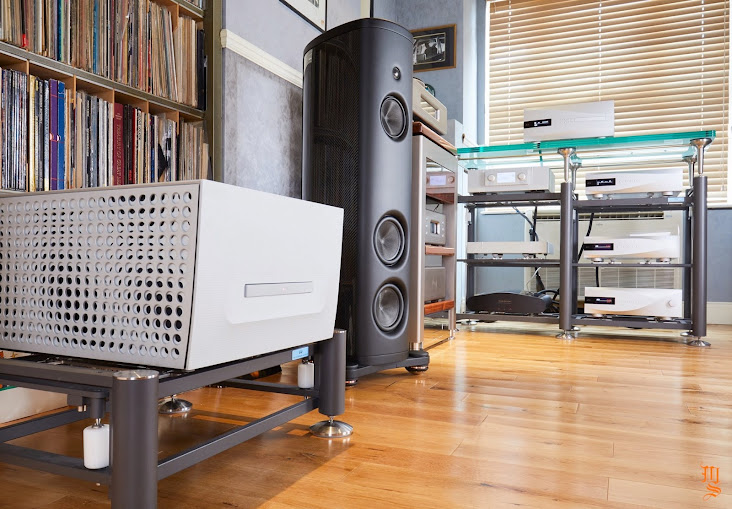
At what (x,y) coordinates should I click in order to perform the action: click on framed photograph. Please return your answer as a coordinate pair (x, y). Looking at the image, I should click on (436, 49).